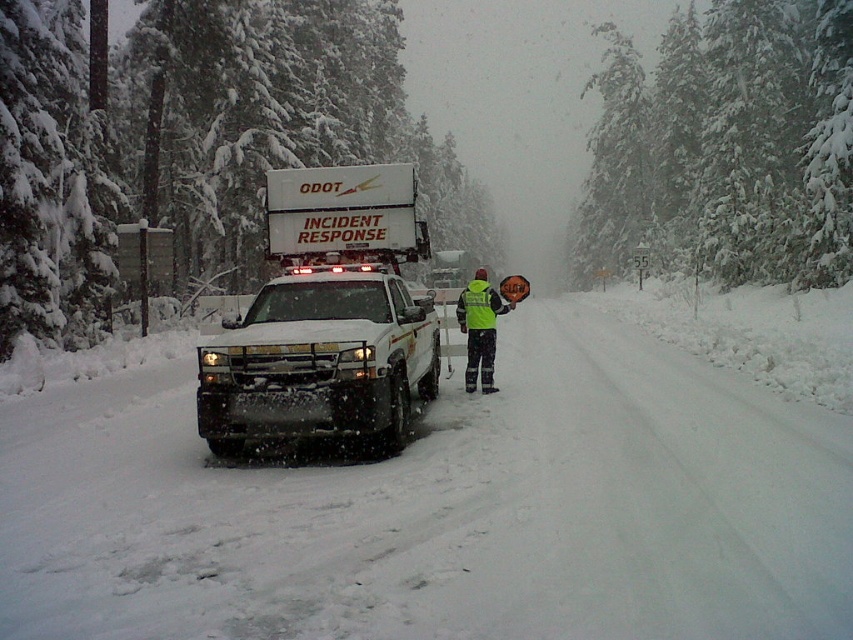
Question: Which object is positioned farthest from the snow-covered evergreen at center?

Choices:
 (A) white fluffy snow at center
 (B) white matte truck at center

Answer: (A)

Question: Considering the relative positions of white fluffy snow at center and white matte truck at center in the image provided, where is white fluffy snow at center located with respect to white matte truck at center?

Choices:
 (A) below
 (B) above

Answer: (A)

Question: Among these points, which one is nearest to the camera?

Choices:
 (A) (474, 312)
 (B) (701, 589)

Answer: (B)

Question: Does white fluffy snow at center appear under high-visibility yellow jacket at center?

Choices:
 (A) yes
 (B) no

Answer: (A)

Question: Where is white fluffy snow at center located in relation to white matte truck at center in the image?

Choices:
 (A) below
 (B) above

Answer: (A)

Question: Which point is closer to the camera taking this photo?

Choices:
 (A) (320, 262)
 (B) (469, 387)

Answer: (A)